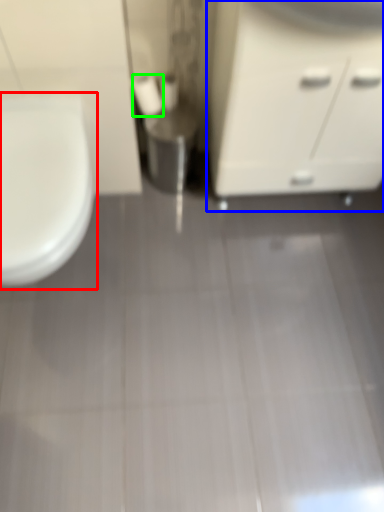
Question: Which is nearer to the toilet (highlighted by a red box)? bathroom cabinet (highlighted by a blue box) or toilet paper (highlighted by a green box).

Choices:
 (A) bathroom cabinet
 (B) toilet paper

Answer: (B)